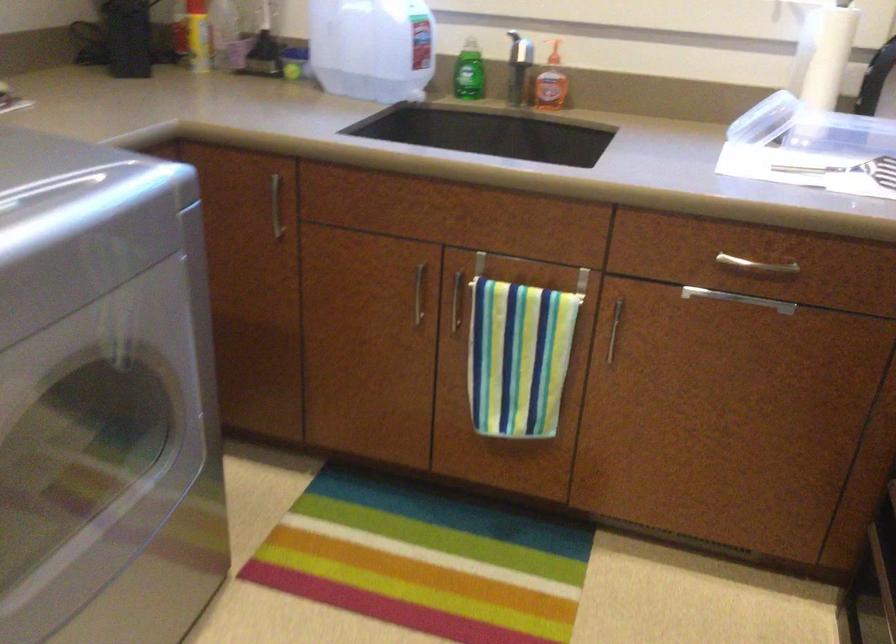
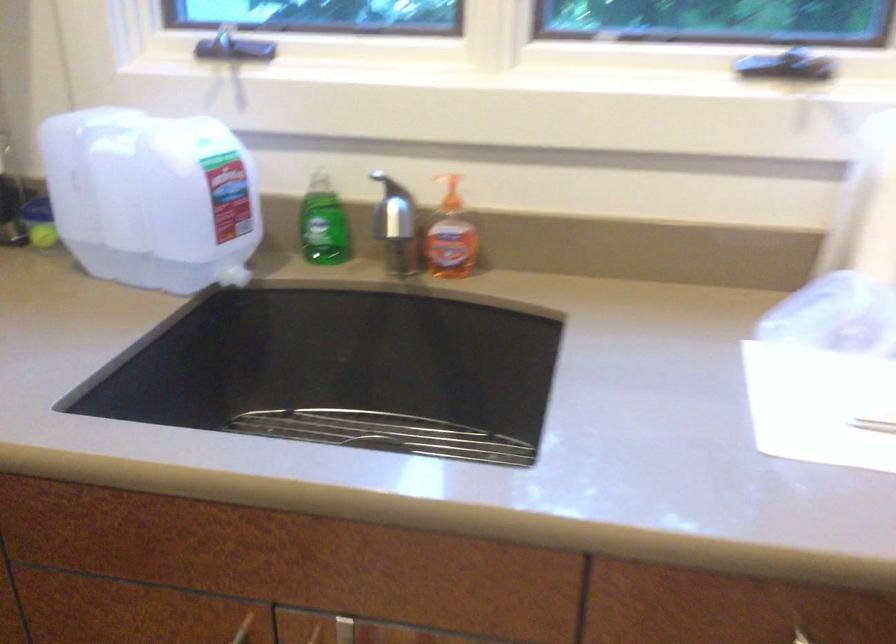
In the second image, find the point that corresponds to the point at 552,80 in the first image.

(451, 236)